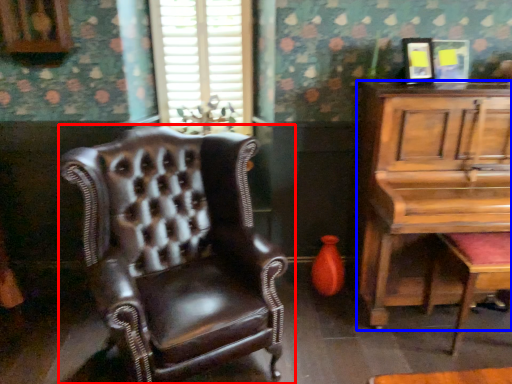
Question: Which object is closer to the camera taking this photo, chair (highlighted by a red box) or table (highlighted by a blue box)?

Choices:
 (A) chair
 (B) table

Answer: (A)